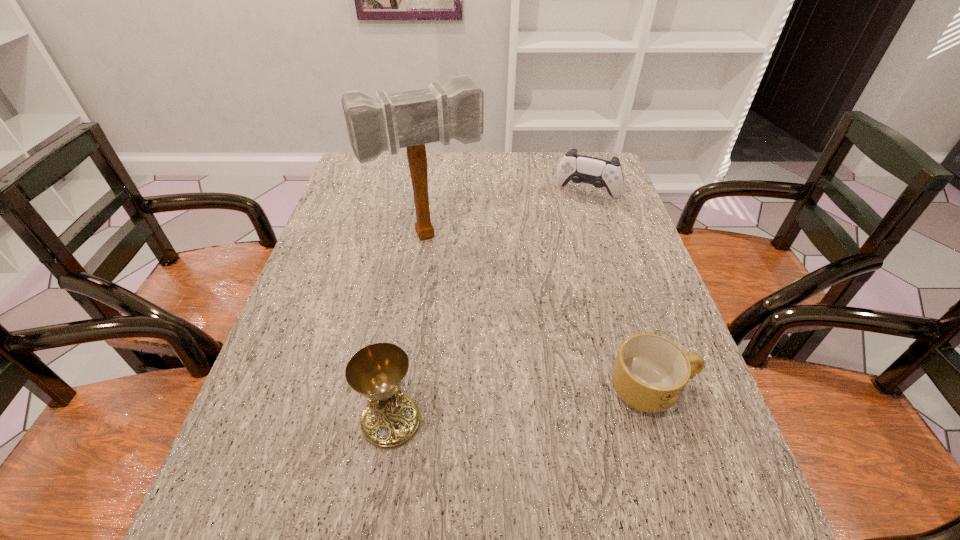
The width and height of the screenshot is (960, 540). Identify the location of vacant space on the desktop that is between the third shortest object and the mug and is positioned on the front-facing side of the control. (492, 409).

Where is `vacant spot on the desktop that is between the third shortest object and the mug and is positioned at the head of the second farthest object`? vacant spot on the desktop that is between the third shortest object and the mug and is positioned at the head of the second farthest object is located at coordinates (510, 407).